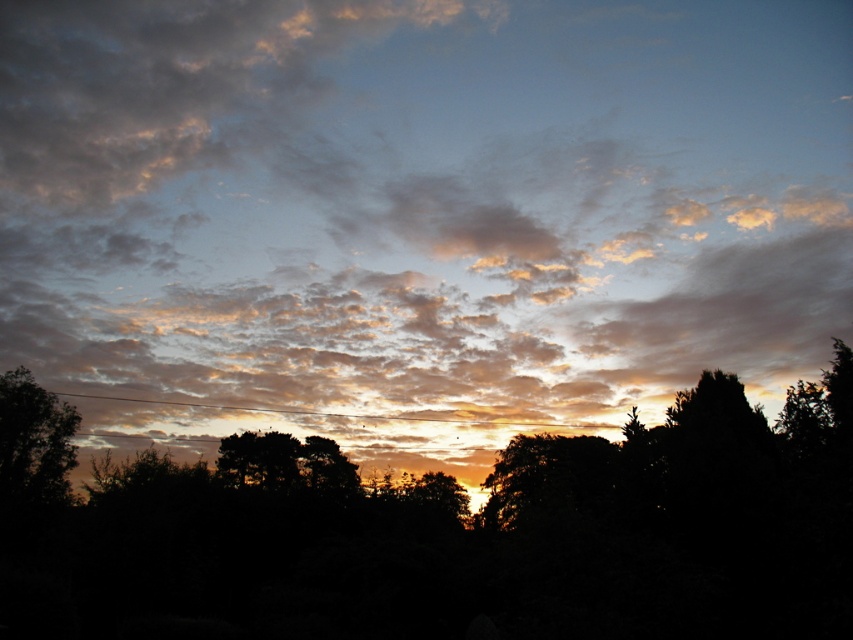
Question: Is cloudy sky at center behind dark green leafy tree at lower left?

Choices:
 (A) yes
 (B) no

Answer: (B)

Question: Which object appears closest to the camera in this image?

Choices:
 (A) cloudy sky at center
 (B) dark green leafy tree at lower left
 (C) silhouette tree at center

Answer: (C)

Question: Among these points, which one is farthest from the camera?

Choices:
 (A) (117, 627)
 (B) (270, 148)
 (C) (42, 481)

Answer: (B)

Question: Is cloudy sky at center closer to the viewer compared to dark green leafy tree at lower left?

Choices:
 (A) no
 (B) yes

Answer: (B)

Question: Does silhouette tree at center appear over dark green leafy tree at lower left?

Choices:
 (A) yes
 (B) no

Answer: (A)

Question: Which of the following is the farthest from the observer?

Choices:
 (A) (71, 451)
 (B) (328, 404)
 (C) (689, 595)

Answer: (B)